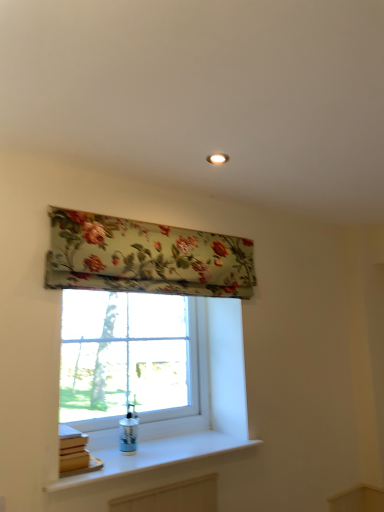
Question: Considering the relative sizes of floral fabric window blind at upper center and clear glass window at center in the image provided, is floral fabric window blind at upper center smaller than clear glass window at center?

Choices:
 (A) no
 (B) yes

Answer: (B)

Question: Is floral fabric window blind at upper center to the right of clear glass window at center from the viewer's perspective?

Choices:
 (A) yes
 (B) no

Answer: (A)

Question: Does floral fabric window blind at upper center have a larger size compared to clear glass window at center?

Choices:
 (A) yes
 (B) no

Answer: (B)

Question: Is floral fabric window blind at upper center looking in the opposite direction of clear glass window at center?

Choices:
 (A) yes
 (B) no

Answer: (B)

Question: Could you tell me if floral fabric window blind at upper center is facing clear glass window at center?

Choices:
 (A) yes
 (B) no

Answer: (B)

Question: Considering the positions of floral fabric window blind at upper center and clear glass window at center in the image, is floral fabric window blind at upper center taller or shorter than clear glass window at center?

Choices:
 (A) short
 (B) tall

Answer: (A)

Question: Is floral fabric window blind at upper center bigger or smaller than clear glass window at center?

Choices:
 (A) big
 (B) small

Answer: (B)

Question: Is floral fabric window blind at upper center inside or outside of clear glass window at center?

Choices:
 (A) outside
 (B) inside

Answer: (A)

Question: Considering the positions of floral fabric window blind at upper center and clear glass window at center in the image, is floral fabric window blind at upper center wider or thinner than clear glass window at center?

Choices:
 (A) wide
 (B) thin

Answer: (B)

Question: Looking at their shapes, would you say floral fabric window blind at upper center is wider or thinner than white smooth window sill at lower center?

Choices:
 (A) wide
 (B) thin

Answer: (B)

Question: From a real-world perspective, relative to white smooth window sill at lower center, is floral fabric window blind at upper center vertically above or below?

Choices:
 (A) above
 (B) below

Answer: (A)

Question: In terms of height, does floral fabric window blind at upper center look taller or shorter compared to white smooth window sill at lower center?

Choices:
 (A) tall
 (B) short

Answer: (A)

Question: From the image's perspective, relative to white smooth window sill at lower center, is floral fabric window blind at upper center above or below?

Choices:
 (A) above
 (B) below

Answer: (A)

Question: From the image's perspective, is white smooth window sill at lower center positioned above or below floral fabric window blind at upper center?

Choices:
 (A) below
 (B) above

Answer: (A)

Question: Is white smooth window sill at lower center taller or shorter than floral fabric window blind at upper center?

Choices:
 (A) short
 (B) tall

Answer: (A)